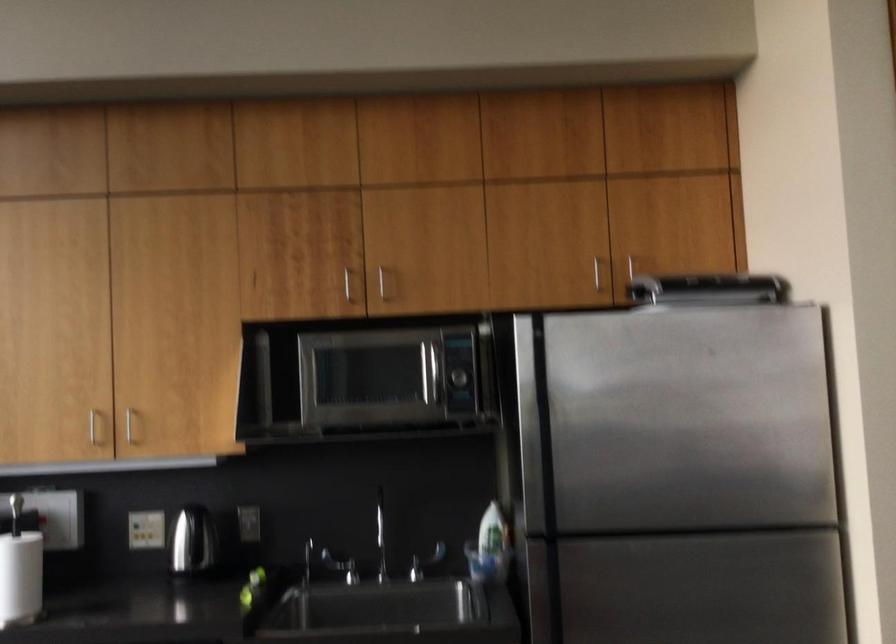
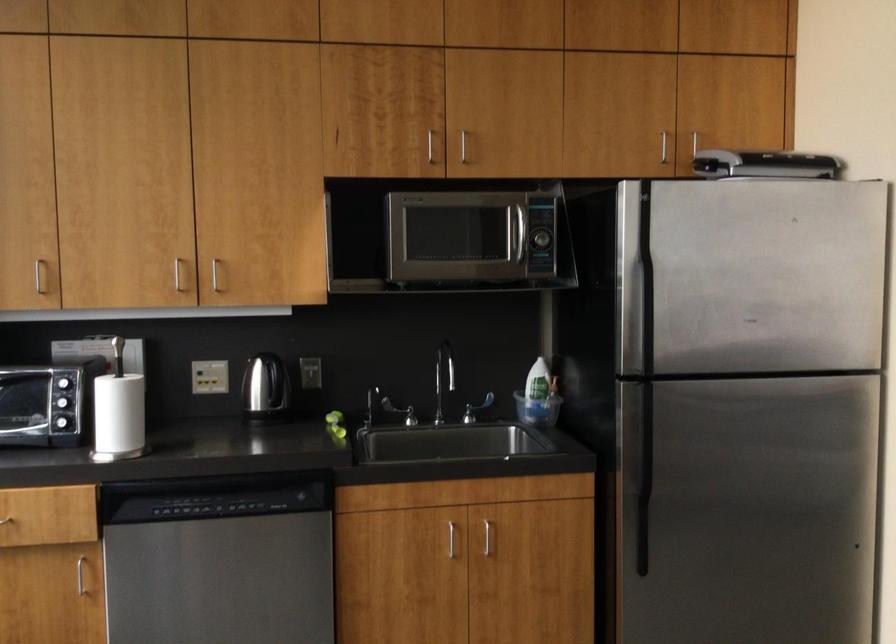
Find the pixel in the second image that matches (x=488, y=536) in the first image.

(539, 391)